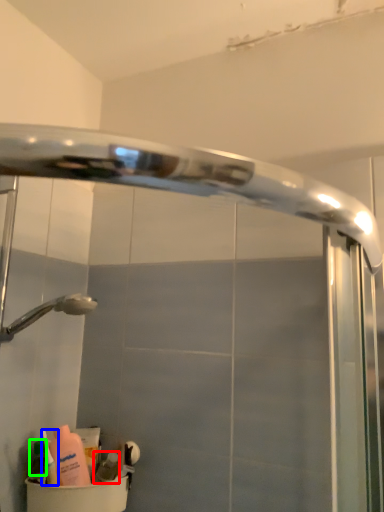
Question: Which object is the farthest from toiletry (highlighted by a red box)? Choose among these: cleaning product (highlighted by a blue box) or toiletry (highlighted by a green box).

Choices:
 (A) cleaning product
 (B) toiletry

Answer: (B)